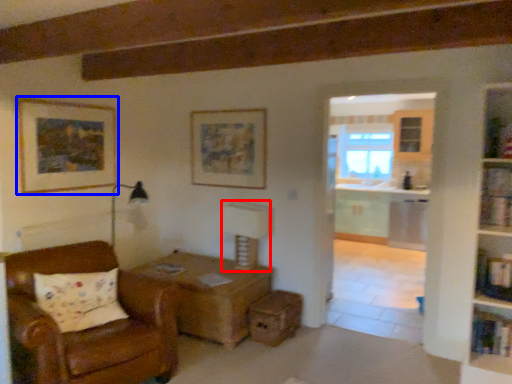
Question: Which object is closer to the camera taking this photo, table lamp (highlighted by a red box) or picture frame (highlighted by a blue box)?

Choices:
 (A) table lamp
 (B) picture frame

Answer: (B)